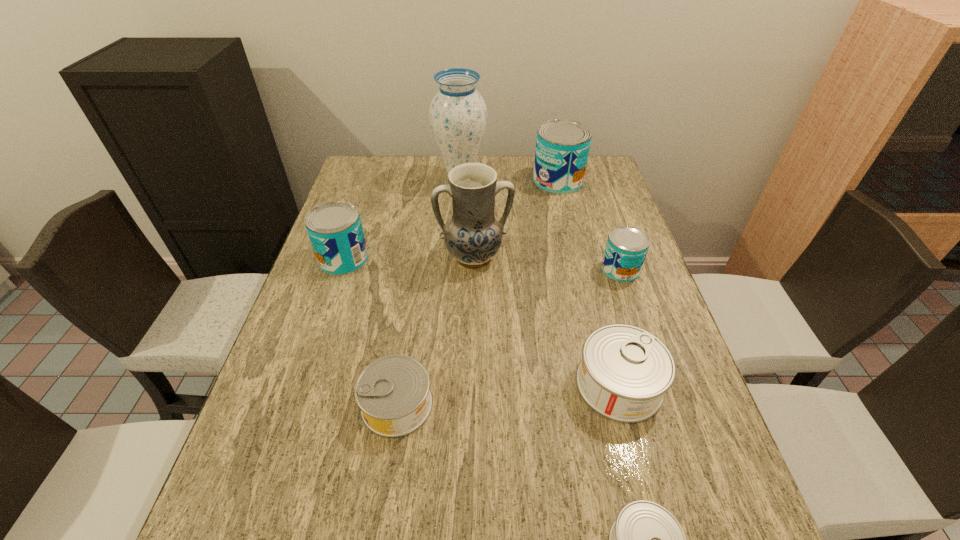
I want to click on the closest blue can to the second biggest blue can, so click(562, 147).

Identify which blue can is the second closest to the smallest blue can. Please provide its 2D coordinates. Your answer should be formatted as a tuple, i.e. [(x, y)], where the tuple contains the x and y coordinates of a point satisfying the conditions above.

[(334, 228)]

Identify the location of the closest silver can to the smallest blue can. The width and height of the screenshot is (960, 540). (625, 371).

Identify the location of silver can that stands as the second closest to the biggest silver can. (393, 392).